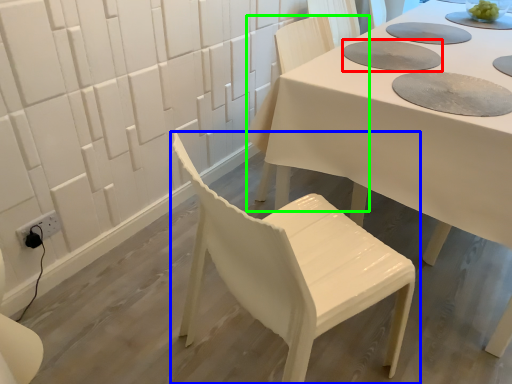
Question: Estimate the real-world distances between objects in this image. Which object is farther from paper plate (highlighted by a red box), chair (highlighted by a blue box) or chair (highlighted by a green box)?

Choices:
 (A) chair
 (B) chair

Answer: (A)